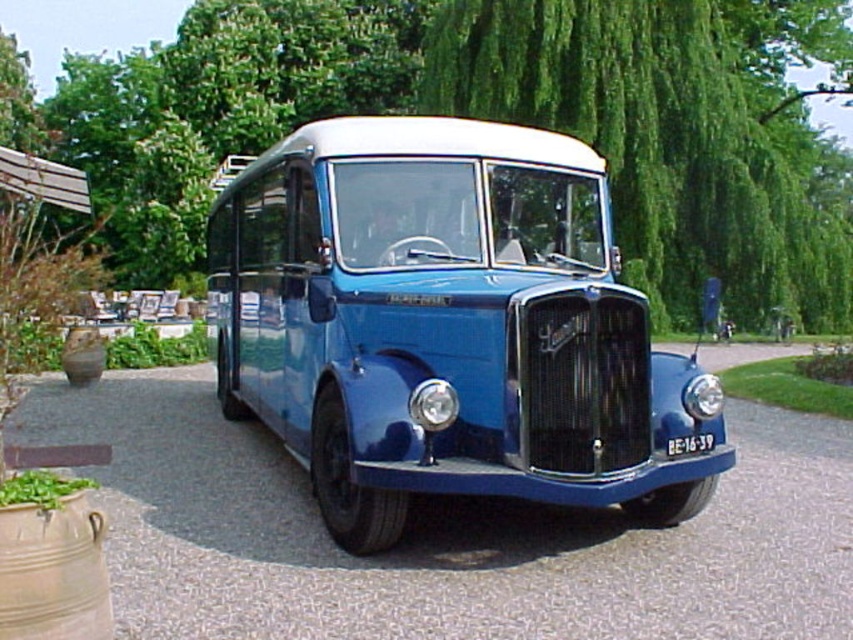
Question: From the image, what is the correct spatial relationship of green leafy tree at center in relation to blue asphalt driveway at center?

Choices:
 (A) below
 (B) above

Answer: (B)

Question: Which point appears closest to the camera in this image?

Choices:
 (A) (740, 48)
 (B) (155, 392)
 (C) (645, 385)
 (D) (689, 448)

Answer: (C)

Question: Which is nearer to the green leafy tree at center?

Choices:
 (A) shiny blue bus at center
 (B) white plastic license plate at center

Answer: (A)

Question: Estimate the real-world distances between objects in this image. Which object is farther from the shiny blue bus at center?

Choices:
 (A) blue asphalt driveway at center
 (B) white plastic license plate at center

Answer: (B)

Question: Can you confirm if green leafy tree at center is positioned below white plastic license plate at center?

Choices:
 (A) no
 (B) yes

Answer: (A)

Question: Can you confirm if green leafy tree at center is wider than white plastic license plate at center?

Choices:
 (A) yes
 (B) no

Answer: (A)